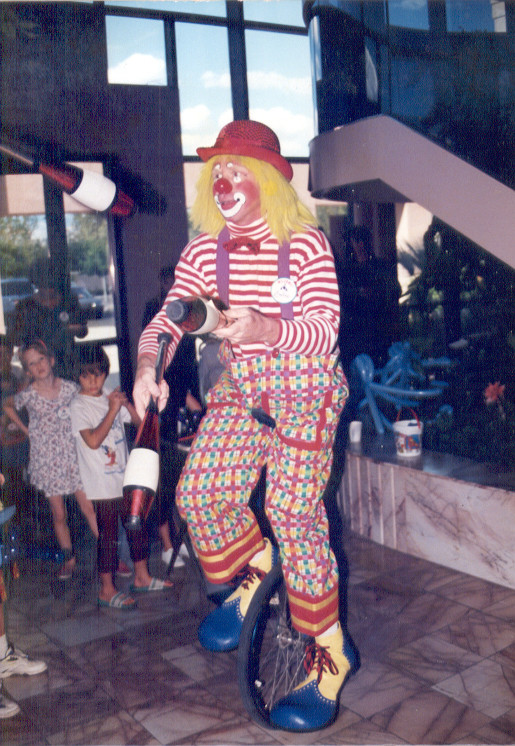
You are a GUI agent. You are given a task and a screenshot of the screen. Output one action in this format:
    pyautogui.click(x=<x>, y=<y>)
    Task: Click on the floor
    
    Given the screenshot: What is the action you would take?
    (105, 674)